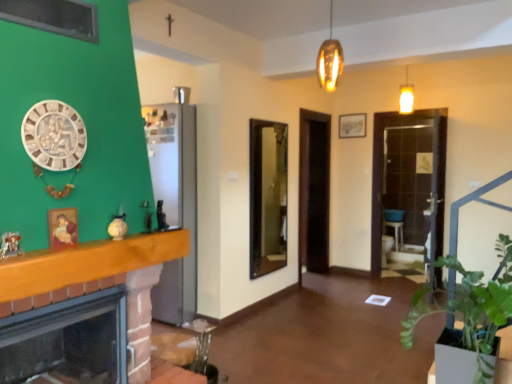
Question: Does brick fireplace at left have a lesser width compared to green leafy plant at lower right?

Choices:
 (A) no
 (B) yes

Answer: (B)

Question: Considering the relative sizes of brick fireplace at left and green leafy plant at lower right in the image provided, is brick fireplace at left wider than green leafy plant at lower right?

Choices:
 (A) no
 (B) yes

Answer: (A)

Question: From a real-world perspective, is brick fireplace at left located higher than green leafy plant at lower right?

Choices:
 (A) no
 (B) yes

Answer: (A)

Question: From a real-world perspective, is brick fireplace at left under green leafy plant at lower right?

Choices:
 (A) yes
 (B) no

Answer: (A)

Question: Would you say brick fireplace at left contains green leafy plant at lower right?

Choices:
 (A) yes
 (B) no

Answer: (B)

Question: In terms of size, does matte wooden picture frame at left appear bigger or smaller than wooden mantel at left?

Choices:
 (A) big
 (B) small

Answer: (B)

Question: In the image, is matte wooden picture frame at left positioned in front of or behind wooden mantel at left?

Choices:
 (A) front
 (B) behind

Answer: (B)

Question: From the image's perspective, relative to wooden mantel at left, is matte wooden picture frame at left above or below?

Choices:
 (A) above
 (B) below

Answer: (A)

Question: Considering the positions of point (72, 216) and point (78, 248), is point (72, 216) closer or farther from the camera than point (78, 248)?

Choices:
 (A) closer
 (B) farther

Answer: (B)

Question: Would you say brick fireplace at left is inside or outside green leafy plant at lower right?

Choices:
 (A) inside
 (B) outside

Answer: (B)

Question: Based on their sizes in the image, would you say brick fireplace at left is bigger or smaller than green leafy plant at lower right?

Choices:
 (A) big
 (B) small

Answer: (B)

Question: Considering the positions of brick fireplace at left and green leafy plant at lower right in the image, is brick fireplace at left wider or thinner than green leafy plant at lower right?

Choices:
 (A) thin
 (B) wide

Answer: (A)

Question: Is brick fireplace at left to the left or to the right of green leafy plant at lower right in the image?

Choices:
 (A) right
 (B) left

Answer: (B)

Question: Relative to matte wooden picture frame at left, is brick fireplace at left in front or behind?

Choices:
 (A) behind
 (B) front

Answer: (B)

Question: From their relative heights in the image, would you say brick fireplace at left is taller or shorter than matte wooden picture frame at left?

Choices:
 (A) tall
 (B) short

Answer: (A)